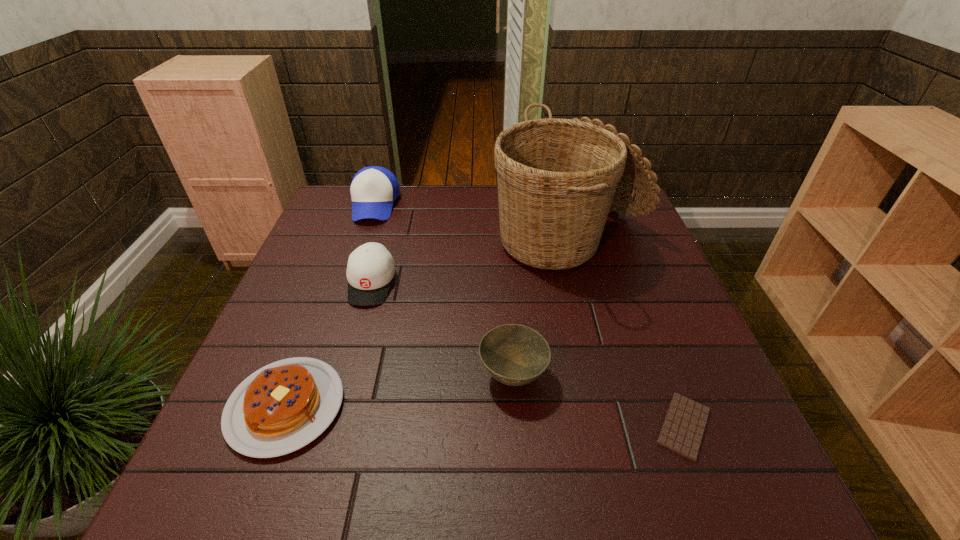
Where is `free space located 0.160m on the right of the pancake`? This screenshot has width=960, height=540. free space located 0.160m on the right of the pancake is located at coordinates (425, 406).

Locate an element on the screen. vacant space positioned 0.270m on the left of the chocolate bar is located at coordinates (506, 426).

Identify the location of basket positioned at the far edge. Image resolution: width=960 pixels, height=540 pixels. (557, 178).

Locate an element on the screen. baseball cap that is at the far edge is located at coordinates (373, 190).

Identify the location of pancake present at the near edge. This screenshot has width=960, height=540. (283, 406).

The image size is (960, 540). In order to click on chocolate bar situated at the near edge in this screenshot , I will do `click(684, 425)`.

Locate an element on the screen. pancake that is at the left edge is located at coordinates (283, 406).

Identify the location of basket that is at the right edge. This screenshot has height=540, width=960. (557, 178).

Find the location of `chocolate bar located at the right edge`. chocolate bar located at the right edge is located at coordinates (684, 425).

This screenshot has width=960, height=540. What are the coordinates of `object situated at the far left corner` in the screenshot? It's located at (373, 190).